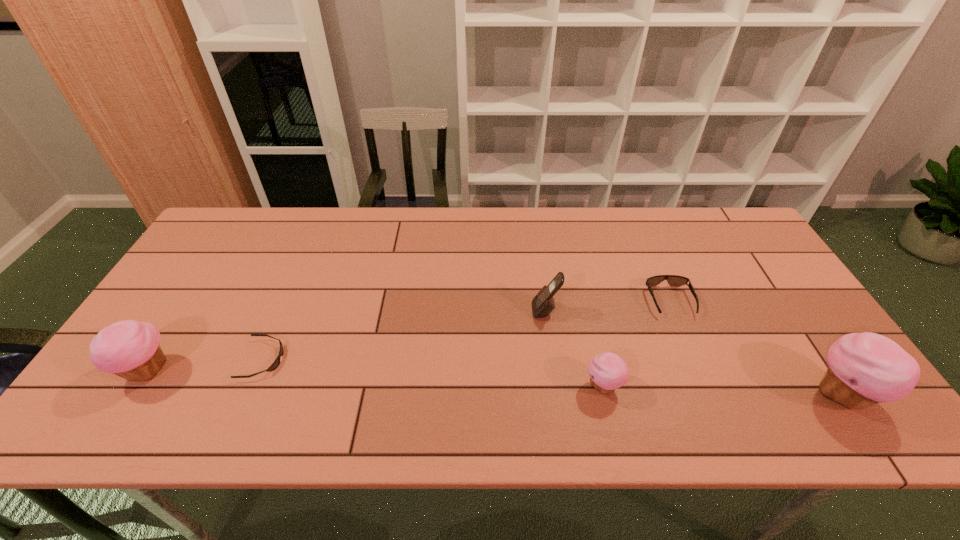
This screenshot has width=960, height=540. I want to click on unoccupied area between the shortest object and the second shortest object, so click(467, 330).

Locate an element on the screen. vacant space that is in between the second shortest cupcake and the fifth tallest object is located at coordinates (408, 336).

Identify the location of empty space that is in between the leftmost object and the shortest cupcake. (375, 379).

This screenshot has width=960, height=540. In order to click on vacant region between the second cupcake from right to left and the leftmost object in this screenshot , I will do [x=375, y=379].

Where is `free point between the right sunglasses and the shortest cupcake`? free point between the right sunglasses and the shortest cupcake is located at coordinates (636, 344).

Where is `free space that is in between the farther sunglasses and the fourth object from right to left`? The image size is (960, 540). free space that is in between the farther sunglasses and the fourth object from right to left is located at coordinates (608, 306).

The image size is (960, 540). I want to click on blank region between the fifth object from left to right and the fourth object from left to right, so click(636, 344).

Find the location of a particular element. The width and height of the screenshot is (960, 540). free space between the third object from right to left and the rightmost object is located at coordinates (722, 390).

What are the coordinates of `blank region between the rightmost cupcake and the fourth object from left to right` in the screenshot? It's located at coord(722,390).

Identify the location of object that is the third closest one to the fifth object from left to right. (543, 303).